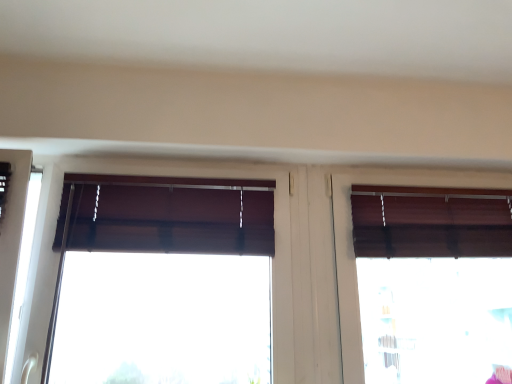
Question: Is brown wooden blinds at right, which is the second window in left-to-right order, thinner than brown fabric window at center, which ranks as the first window in left-to-right order?

Choices:
 (A) no
 (B) yes

Answer: (A)

Question: Is brown wooden blinds at right, which is the 1th window from right to left, oriented towards brown fabric window at center, which is the 2th window in right-to-left order?

Choices:
 (A) no
 (B) yes

Answer: (A)

Question: From a real-world perspective, is brown wooden blinds at right, which is the second window in left-to-right order, beneath brown fabric window at center, which is the 2th window in right-to-left order?

Choices:
 (A) no
 (B) yes

Answer: (B)

Question: From the image's perspective, would you say brown wooden blinds at right, which is the second window in left-to-right order, is shown under brown fabric window at center, which ranks as the first window in left-to-right order?

Choices:
 (A) no
 (B) yes

Answer: (B)

Question: Is brown wooden blinds at right, which is the second window in left-to-right order, outside brown fabric window at center, which is the 2th window in right-to-left order?

Choices:
 (A) no
 (B) yes

Answer: (B)

Question: From a real-world perspective, is brown wooden blinds at right, which is the second window in left-to-right order, on brown fabric window at center, which ranks as the first window in left-to-right order?

Choices:
 (A) yes
 (B) no

Answer: (B)

Question: From the image's perspective, is brown fabric window at center, which ranks as the first window in left-to-right order, above brown wooden blinds at right, which is the second window in left-to-right order?

Choices:
 (A) no
 (B) yes

Answer: (B)

Question: From the image's perspective, would you say brown fabric window at center, which is the 2th window in right-to-left order, is shown under brown wooden blinds at right, which is the 1th window from right to left?

Choices:
 (A) no
 (B) yes

Answer: (A)

Question: Could brown wooden blinds at right, which is the second window in left-to-right order, be considered to be inside brown fabric window at center, which ranks as the first window in left-to-right order?

Choices:
 (A) no
 (B) yes

Answer: (A)

Question: Is brown fabric window at center, which ranks as the first window in left-to-right order, facing towards brown wooden blinds at right, which is the second window in left-to-right order?

Choices:
 (A) no
 (B) yes

Answer: (A)

Question: Is brown fabric window at center, which is the 2th window in right-to-left order, bigger than brown wooden blinds at right, which is the second window in left-to-right order?

Choices:
 (A) yes
 (B) no

Answer: (A)

Question: Considering the relative sizes of brown fabric window at center, which ranks as the first window in left-to-right order, and brown wooden blinds at right, which is the second window in left-to-right order, in the image provided, is brown fabric window at center, which ranks as the first window in left-to-right order, wider than brown wooden blinds at right, which is the second window in left-to-right order,?

Choices:
 (A) no
 (B) yes

Answer: (A)

Question: From the image's perspective, is brown fabric window at center, which is the 2th window in right-to-left order, located above or below brown wooden blinds at right, which is the second window in left-to-right order?

Choices:
 (A) below
 (B) above

Answer: (B)